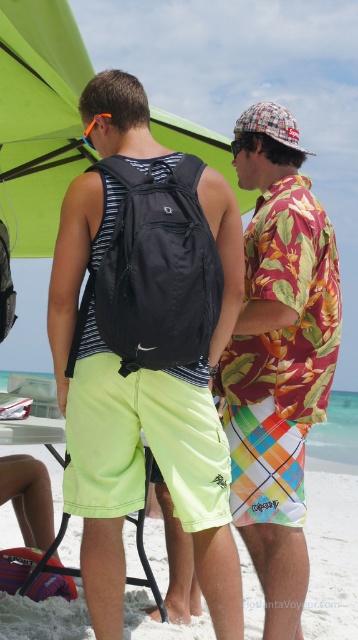
Which is behind, point (223, 227) or point (213, 148)?

Point (213, 148)

Who is taller, matte black backpack at center or green fabric umbrella at upper center?

With more height is matte black backpack at center.

Who is more forward, (207, 193) or (57, 205)?

Positioned in front is point (207, 193).

I want to click on matte black backpack at center, so click(70, 268).

Which is more to the right, floral print shirt at center or white sandy beach at lower center?

Positioned to the right is white sandy beach at lower center.

Identify the location of floral print shirt at center. The image size is (358, 640). (278, 356).

Is matte black backpack at center to the right of white sandy beach at lower center from the viewer's perspective?

Incorrect, matte black backpack at center is not on the right side of white sandy beach at lower center.

Who is taller, matte black backpack at center or white sandy beach at lower center?

With more height is white sandy beach at lower center.

Does point (226, 252) lie behind point (60, 490)?

No, (226, 252) is closer to viewer.

Where is `matte black backpack at center`? matte black backpack at center is located at coordinates (70, 268).